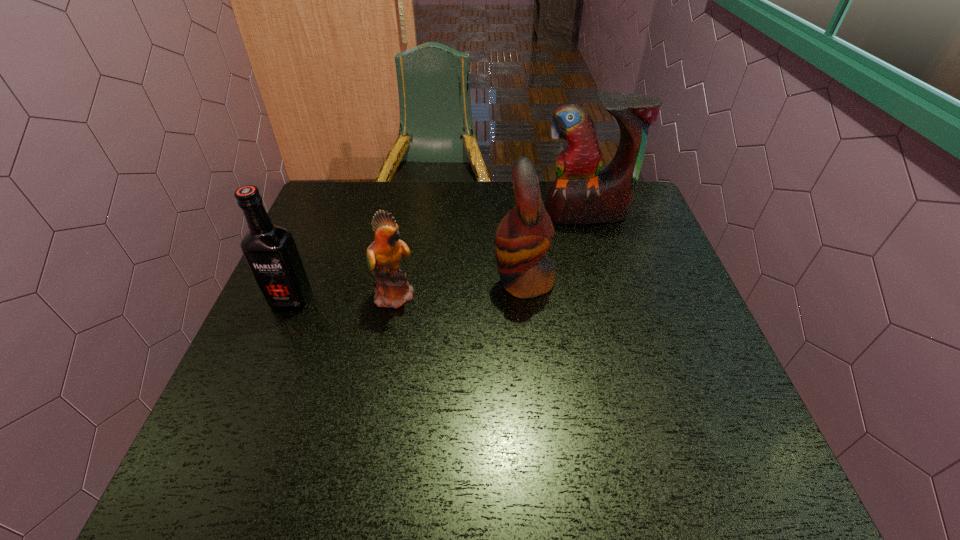
Point out which object is positioned as the nearest to the farthest object. Please provide its 2D coordinates. Your answer should be formatted as a tuple, i.e. [(x, y)], where the tuple contains the x and y coordinates of a point satisfying the conditions above.

[(522, 238)]

Find the location of a particular element. Image resolution: width=960 pixels, height=540 pixels. the third closest object to the farthest object is located at coordinates (270, 251).

This screenshot has height=540, width=960. Find the location of `parrot that stands as the closest to the second object from left to right`. parrot that stands as the closest to the second object from left to right is located at coordinates (522, 238).

Where is `the third closest parrot to the liquor`? The height and width of the screenshot is (540, 960). the third closest parrot to the liquor is located at coordinates (581, 194).

The height and width of the screenshot is (540, 960). Find the location of `vacant space that satisfies the following two spatial constraints: 1. at the face of the farthest parrot; 2. on the front-facing side of the shortest parrot`. vacant space that satisfies the following two spatial constraints: 1. at the face of the farthest parrot; 2. on the front-facing side of the shortest parrot is located at coordinates (609, 294).

You are a GUI agent. You are given a task and a screenshot of the screen. Output one action in this format:
    pyautogui.click(x=<x>, y=<y>)
    Task: Click on the vacant point that satisfies the following two spatial constraints: 1. on the front-facing side of the leftmost parrot; 2. on the front-facing side of the leftmost object
    This screenshot has width=960, height=540.
    Given the screenshot: What is the action you would take?
    pyautogui.click(x=395, y=300)

Locate an element on the screen. vacant space that satisfies the following two spatial constraints: 1. at the face of the farthest object; 2. on the front-facing side of the shortest object is located at coordinates [x=609, y=294].